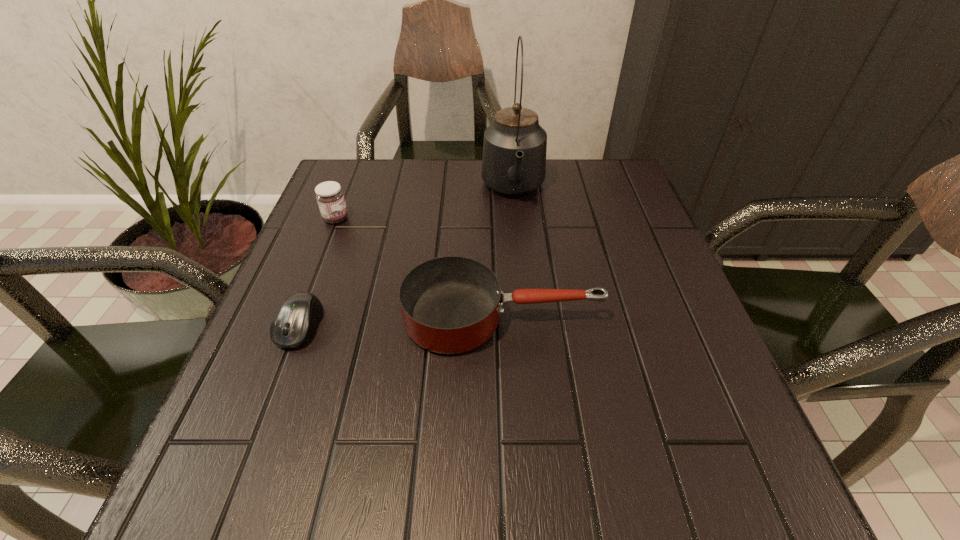
In order to click on free region that satisfies the following two spatial constraints: 1. on the front label of the jam; 2. on the back side of the shortest object in this screenshot , I will do `click(294, 326)`.

Identify the location of free space that satisfies the following two spatial constraints: 1. on the back side of the mouse; 2. on the front label of the jam. Image resolution: width=960 pixels, height=540 pixels. (341, 219).